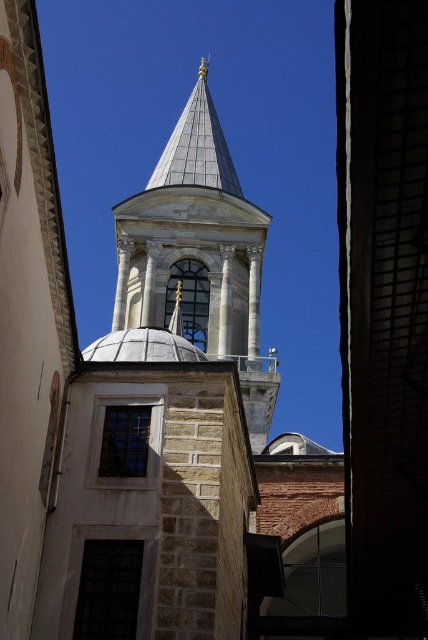
You are an architect analyzing the structure of a historical building. You observe the white stone tower at center and the white marble dome at center. Based on their positions and the description provided, which structure has a larger base width?

The white stone tower at center might be wider than white marble dome at center according to the description, so the white stone tower at center likely has a larger base width.

You are standing in front of the historical building shown in the image. You want to locate the white stone tower at center. Based on the coordinates provided, where exactly should you look to find it?

The white stone tower at center is located at coordinates point (199, 253).

You are an architect analyzing the historical building. Based on the image, which structure is taller between the white stone tower at center and the white marble dome at center?

The white stone tower at center is much taller than the white marble dome at center.